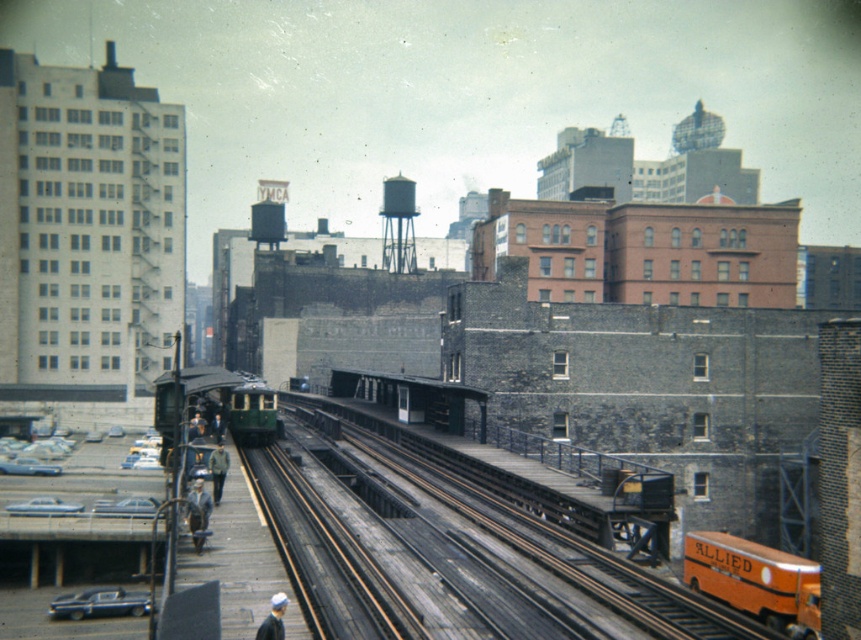
Can you confirm if light brown leather jacket at center is positioned below khaki fabric jacket at center?

Indeed, light brown leather jacket at center is positioned under khaki fabric jacket at center.

Is point (195, 538) positioned after point (223, 458)?

No.

The image size is (861, 640). In order to click on light brown leather jacket at center in this screenshot , I will do `click(197, 513)`.

Does green matte train at center come in front of white fabric hat at lower center?

No, green matte train at center is behind white fabric hat at lower center.

Who is more forward, (164, 440) or (276, 605)?

Point (276, 605)

I want to click on green matte train at center, so click(x=230, y=403).

Does light brown leather jacket at center have a larger size compared to white fabric hat at lower center?

Yes, light brown leather jacket at center is bigger than white fabric hat at lower center.

Can you confirm if light brown leather jacket at center is smaller than white fabric hat at lower center?

Incorrect, light brown leather jacket at center is not smaller in size than white fabric hat at lower center.

Does point (202, 497) come in front of point (270, 616)?

No, it is behind (270, 616).

Locate an element on the screen. The height and width of the screenshot is (640, 861). light brown leather jacket at center is located at coordinates (197, 513).